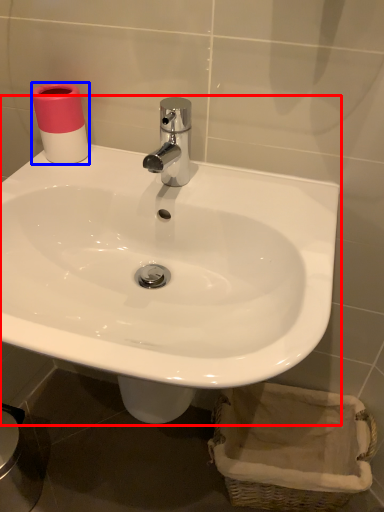
Question: Among these objects, which one is nearest to the camera, sink (highlighted by a red box) or toilet paper (highlighted by a blue box)?

Choices:
 (A) sink
 (B) toilet paper

Answer: (A)